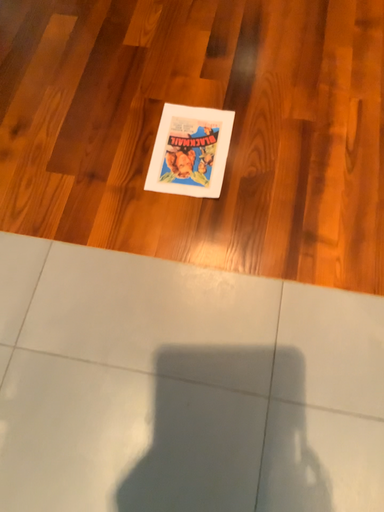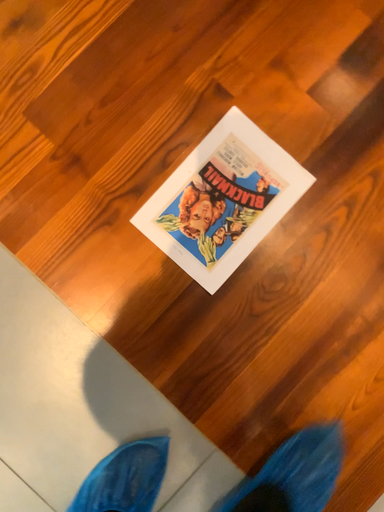
Question: Which way did the camera rotate in the video?

Choices:
 (A) rotated left
 (B) rotated right

Answer: (A)